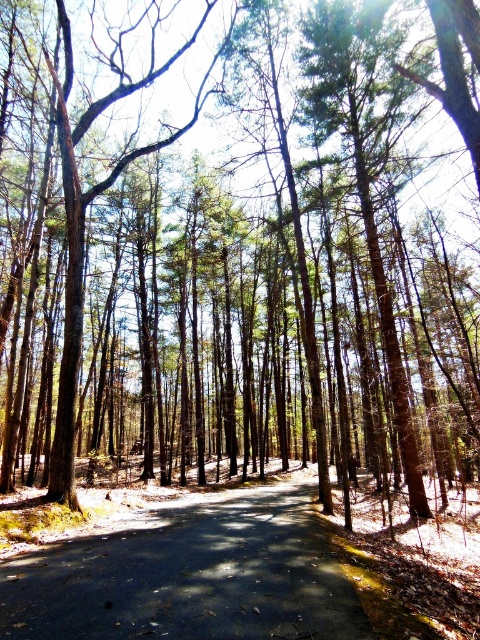
You are a hiker carrying a backpack and need to cross the dark asphalt road at center. The road is 11.41 feet away from your current position. Your backpack has a width of 2 feet. Can you safely cross the road without needing to adjust your backpack?

The dark asphalt road at center is 11.41 feet wide. Since your backpack is only 2 feet wide, you can safely cross the road without needing to adjust it as the road is significantly wider than your backpack.

You are a hiker standing at the start of the dark asphalt road at center and want to reach a cabin located to the east of the brown textured tree at center. Which direction should you head relative to the road?

The dark asphalt road at center is positioned on the right side of the brown textured tree at center. To reach the cabin east of the tree, you should head to the left of the road since the tree is to the road left, and east would be beyond the tree from that position.

You are a delivery person with a 2.5 meter wide truck. You need to drive through the forest along the dark asphalt road at center. Can your truck fit on the road without hitting the brown textured tree at center?

The dark asphalt road at center is narrower than the brown textured tree at center, so the truck might not fit safely. The road is narrower than the tree, which could mean it is too narrow for a 2.5 meter wide truck. Consider taking an alternative route or checking road dimensions before proceeding.